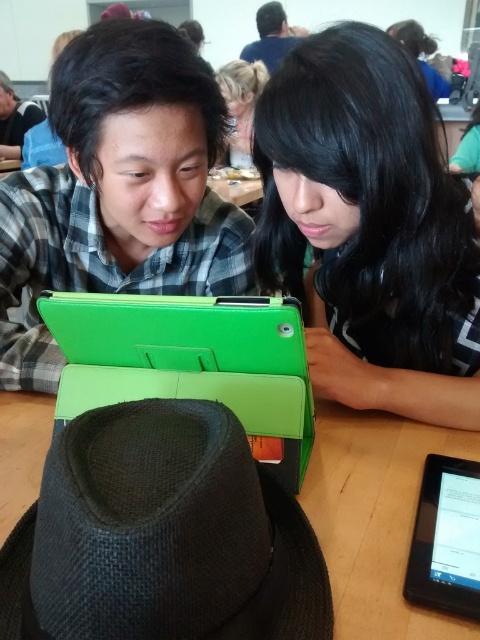
Question: Does matte green tablet at center appear over dark brown hair at upper center?

Choices:
 (A) yes
 (B) no

Answer: (B)

Question: Is green leather laptop at center smaller than black matte tablet at lower right?

Choices:
 (A) no
 (B) yes

Answer: (A)

Question: From the image, what is the correct spatial relationship of shiny black hair at upper right in relation to matte green tablet at center?

Choices:
 (A) above
 (B) below

Answer: (A)

Question: Based on their relative distances, which object is nearer to the blonde hair at upper center?

Choices:
 (A) black matte tablet at lower right
 (B) matte black shirt at upper left
 (C) matte green tablet at center
 (D) green leather laptop at center

Answer: (B)

Question: Which of the following is the farthest from the observer?

Choices:
 (A) matte black shirt at upper left
 (B) blonde hair at upper center
 (C) green matte tablet at center

Answer: (A)

Question: Among these objects, which one is farthest from the camera?

Choices:
 (A) blonde hair at upper center
 (B) green leather laptop at center
 (C) black matte tablet at lower right

Answer: (A)